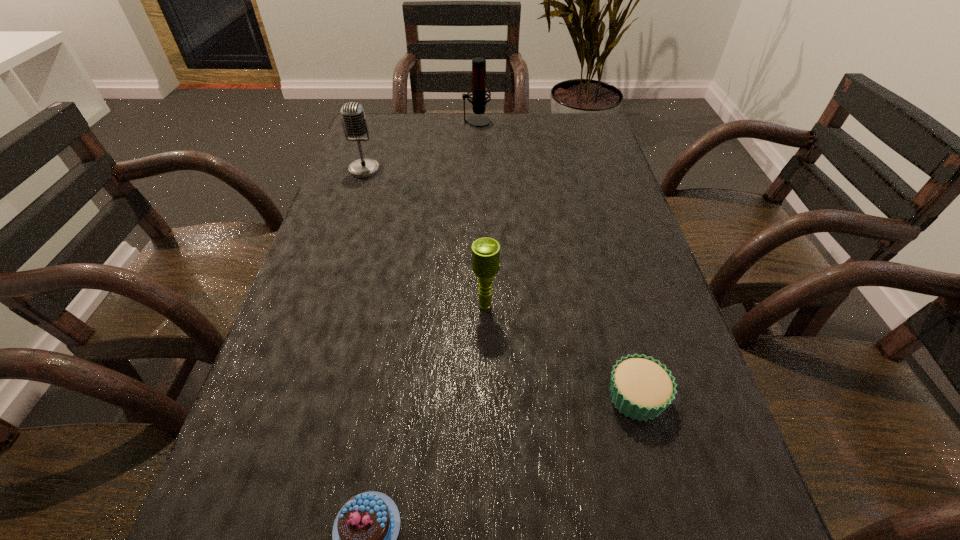
Locate an element on the screen. The image size is (960, 540). the farthest object is located at coordinates (479, 91).

At what (x,y) coordinates should I click in order to perform the action: click on the leftmost microphone. Please return your answer as a coordinate pair (x, y). The image size is (960, 540). Looking at the image, I should click on (354, 122).

Where is `the second nearest microphone`? the second nearest microphone is located at coordinates 354,122.

Locate an element on the screen. The image size is (960, 540). the third farthest object is located at coordinates (485, 251).

This screenshot has width=960, height=540. What are the coordinates of `the rightmost object` in the screenshot? It's located at (642, 388).

Where is `the second nearest object`? Image resolution: width=960 pixels, height=540 pixels. the second nearest object is located at coordinates (642, 388).

You are a GUI agent. You are given a task and a screenshot of the screen. Output one action in this format:
    pyautogui.click(x=<x>, y=<y>)
    Task: Click on the free space located 0.280m on the left of the farthest object
    This screenshot has width=960, height=540.
    Given the screenshot: What is the action you would take?
    pyautogui.click(x=372, y=122)

Locate an element on the screen. The width and height of the screenshot is (960, 540). blank area located 0.090m on the right of the leftmost microphone is located at coordinates [x=414, y=170].

The height and width of the screenshot is (540, 960). I want to click on vacant space positioned 0.060m on the right of the nearest microphone, so click(530, 306).

This screenshot has width=960, height=540. In order to click on vacant space located on the back of the second nearest object in this screenshot , I will do `click(617, 328)`.